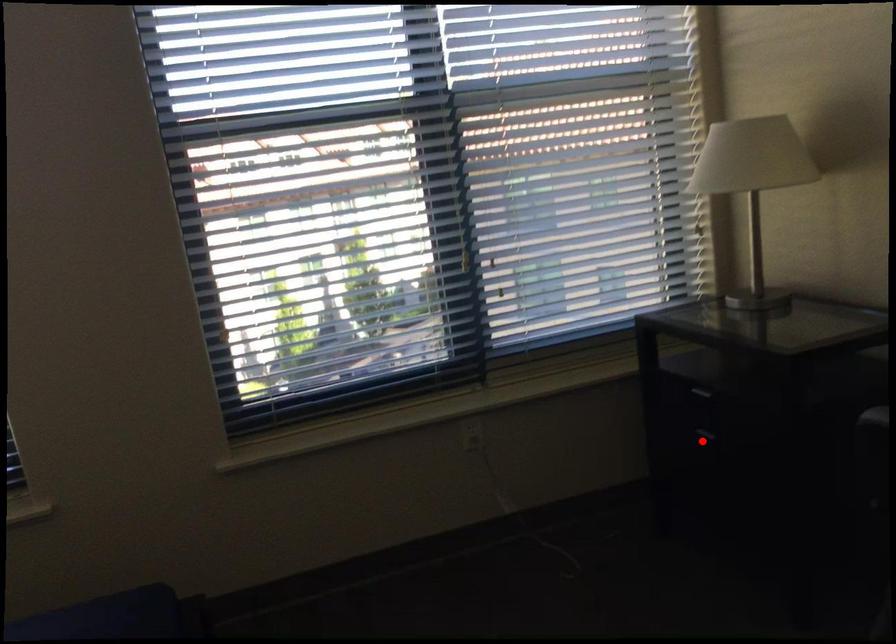
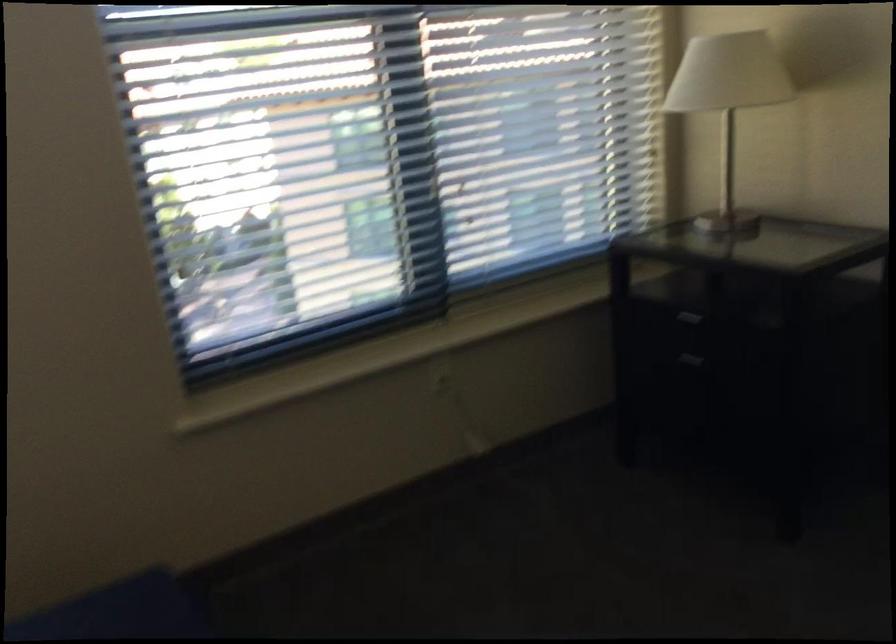
Locate, in the second image, the point that corresponds to the highlighted location in the first image.

(685, 366)